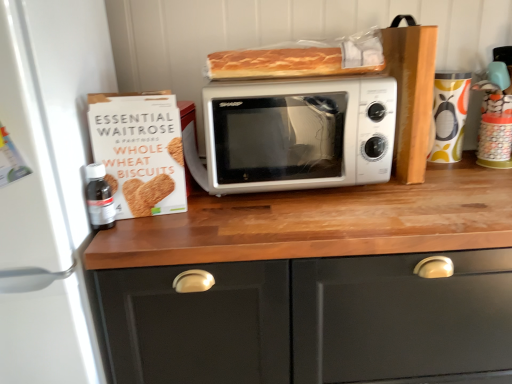
Locate an element on the screen. free spot in front of white matte microwave at center is located at coordinates (302, 225).